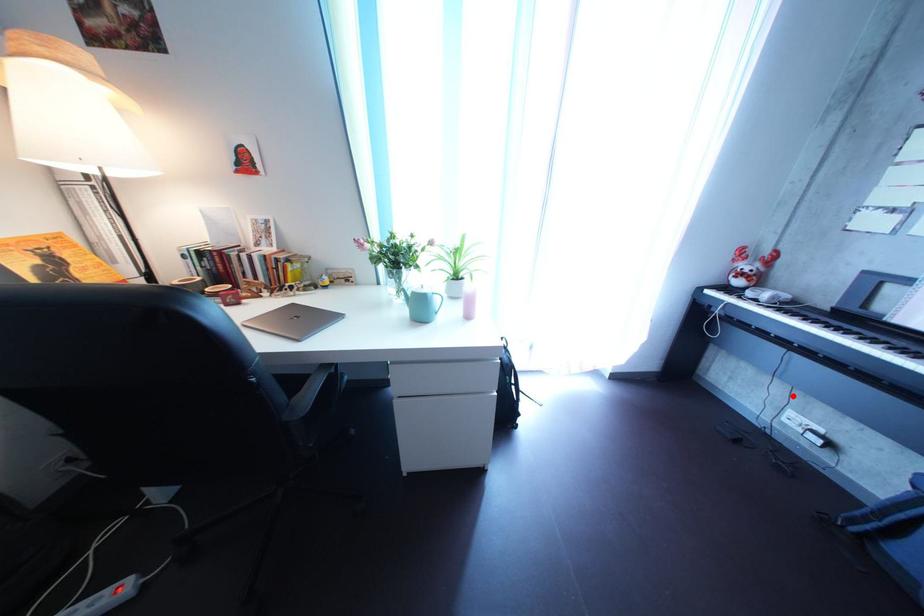
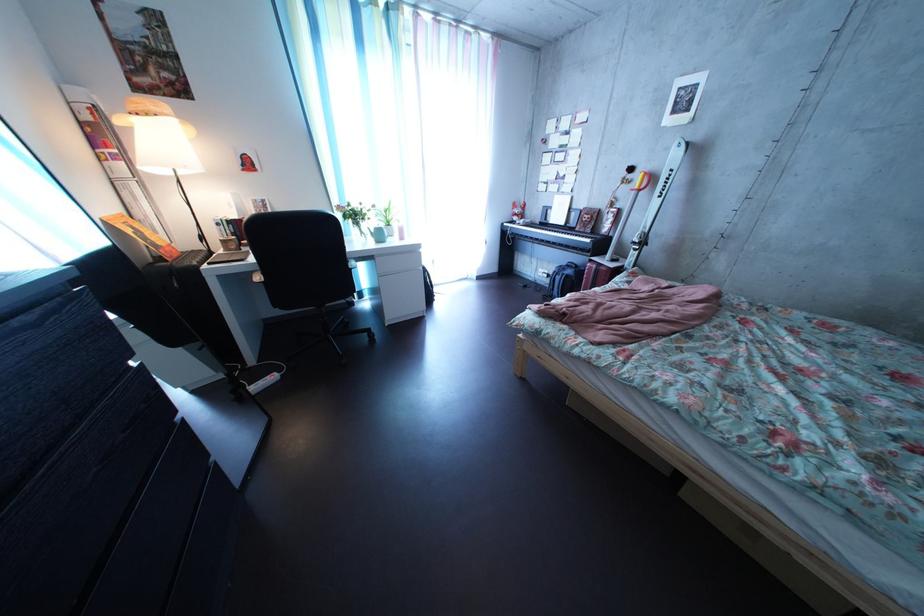
In the second image, find the point that corresponds to the highlighted location in the first image.

(550, 269)